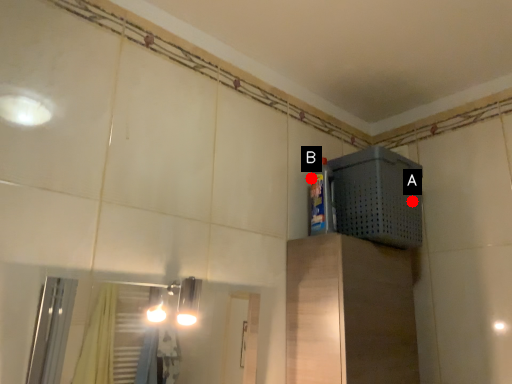
Question: Two points are circled on the image, labeled by A and B beside each circle. Which point is closer to the camera taking this photo?

Choices:
 (A) A is closer
 (B) B is closer

Answer: (A)